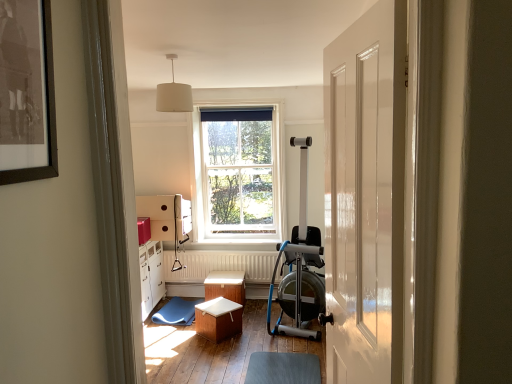
Identify the location of gray rubber footrest at lower center. (283, 368).

This screenshot has height=384, width=512. Describe the element at coordinates (283, 368) in the screenshot. I see `gray rubber footrest at lower center` at that location.

Describe the element at coordinates (174, 94) in the screenshot. I see `white fabric lampshade at upper center` at that location.

What do you see at coordinates (215, 351) in the screenshot?
I see `wooden box at center` at bounding box center [215, 351].

What do you see at coordinates (218, 319) in the screenshot? The width and height of the screenshot is (512, 384). I see `wooden stool at center, the second stool when ordered from back to front` at bounding box center [218, 319].

What do you see at coordinates (220, 265) in the screenshot? I see `white textured radiator at center` at bounding box center [220, 265].

You are a GUI agent. You are given a task and a screenshot of the screen. Output one action in this format:
    pyautogui.click(x=<x>, y=<y>)
    Task: Click on the gray rubber footrest at lower center
    The width and height of the screenshot is (512, 384).
    Given the screenshot: What is the action you would take?
    pyautogui.click(x=283, y=368)

Who is shorter, silver metallic rowing machine at center or wooden stool at center, which is counted as the 1th stool, starting from the back?

wooden stool at center, which is counted as the 1th stool, starting from the back, is shorter.

Does silver metallic rowing machine at center come in front of wooden stool at center, which is counted as the 1th stool, starting from the back?

Yes, the depth of silver metallic rowing machine at center is less than that of wooden stool at center, which is counted as the 1th stool, starting from the back.

Is silver metallic rowing machine at center outside of wooden stool at center, which is the 2th stool in front-to-back order?

Yes, silver metallic rowing machine at center is outside of wooden stool at center, which is the 2th stool in front-to-back order.

The width and height of the screenshot is (512, 384). I want to click on the 1st stool to the left when counting from the silver metallic rowing machine at center, so click(x=226, y=286).

Visually, is wooden box at center positioned to the left or to the right of blue rubber mat at center?

Clearly, wooden box at center is on the right of blue rubber mat at center in the image.

Is wooden box at center wider or thinner than blue rubber mat at center?

In the image, wooden box at center appears to be wider than blue rubber mat at center.

Between wooden box at center and blue rubber mat at center, which one is positioned in front?

wooden box at center is more forward.

Who is taller, white textured radiator at center or wooden stool at center, the second stool when ordered from back to front?

Standing taller between the two is white textured radiator at center.

Between white textured radiator at center and wooden stool at center, the second stool when ordered from back to front, which one has larger width?

wooden stool at center, the second stool when ordered from back to front, is wider.

From the image's perspective, is white textured radiator at center located beneath wooden stool at center, the second stool when ordered from back to front?

No.

Could you measure the distance between white fabric lampshade at upper center and wooden stool at center, which is the 2th stool in front-to-back order?

They are 7.86 feet apart.

Between white fabric lampshade at upper center and wooden stool at center, which is counted as the 1th stool, starting from the back, which one appears on the left side from the viewer's perspective?

white fabric lampshade at upper center is more to the left.

Who is smaller, white fabric lampshade at upper center or wooden stool at center, which is the 2th stool in front-to-back order?

A: With smaller size is white fabric lampshade at upper center.

Is white fabric lampshade at upper center far away from wooden stool at center, which is counted as the 1th stool, starting from the back?

Yes.

In the scene shown: From a real-world perspective, is white fabric lampshade at upper center on top of wooden stool at center, the second stool when ordered from back to front?

Yes, from a real-world perspective, white fabric lampshade at upper center is on top of wooden stool at center, the second stool when ordered from back to front.

Which point is more forward, (x=164, y=99) or (x=229, y=333)?

Point (x=164, y=99)

Which of these two, white fabric lampshade at upper center or wooden stool at center, the second stool when ordered from back to front, stands taller?

white fabric lampshade at upper center.

Can you confirm if white fabric lampshade at upper center is smaller than wooden stool at center, which ranks as the first stool in front-to-back order?

Correct, white fabric lampshade at upper center occupies less space than wooden stool at center, which ranks as the first stool in front-to-back order.

Is white textured radiator at center to the right of gray rubber footrest at lower center from the viewer's perspective?

Answer: In fact, white textured radiator at center is to the left of gray rubber footrest at lower center.

Are white textured radiator at center and gray rubber footrest at lower center beside each other?

There is a gap between white textured radiator at center and gray rubber footrest at lower center.

Consider the image. Which of these two, white textured radiator at center or gray rubber footrest at lower center, stands taller?

Standing taller between the two is white textured radiator at center.

From a real-world perspective, between white textured radiator at center and gray rubber footrest at lower center, who is vertically higher?

white textured radiator at center is physically above.

Is wooden stool at center, which is counted as the 1th stool, starting from the back, far away from blue rubber mat at center?

wooden stool at center, which is counted as the 1th stool, starting from the back, is near blue rubber mat at center, not far away.

Relative to blue rubber mat at center, is wooden stool at center, which is counted as the 1th stool, starting from the back, in front or behind?

wooden stool at center, which is counted as the 1th stool, starting from the back, is positioned farther from the viewer than blue rubber mat at center.

From a real-world perspective, is wooden stool at center, which is the 2th stool in front-to-back order, positioned under blue rubber mat at center based on gravity?

Actually, wooden stool at center, which is the 2th stool in front-to-back order, is physically above blue rubber mat at center in the real world.

At what (x,y) coordinates should I click in order to perform the action: click on the 1st stool directly beneath the silver metallic rowing machine at center (from a real-world perspective). Please return your answer as a coordinate pair (x, y). Image resolution: width=512 pixels, height=384 pixels. Looking at the image, I should click on (226, 286).

The width and height of the screenshot is (512, 384). In the image, there is a wooden box at center. Identify the location of swivel chair above it (from the image's perspective). (176, 312).

Looking at the image, which one is located closer to white fabric lampshade at upper center, white textured radiator at center or white wooden window at center?

The object closer to white fabric lampshade at upper center is white wooden window at center.

Considering their positions, is gray rubber footrest at lower center positioned closer to wooden stool at center, the second stool when ordered from back to front, than wooden stool at center, which is the 2th stool in front-to-back order?

wooden stool at center, which is the 2th stool in front-to-back order, is positioned closer to the anchor wooden stool at center, the second stool when ordered from back to front.

From the image, which object appears to be nearer to wooden stool at center, which ranks as the first stool in front-to-back order, blue rubber mat at center or wooden stool at center, which is the 2th stool in front-to-back order?

wooden stool at center, which is the 2th stool in front-to-back order, lies closer to wooden stool at center, which ranks as the first stool in front-to-back order, than the other object.

Considering their positions, is wooden stool at center, which is the 2th stool in front-to-back order, positioned closer to white textured radiator at center than blue rubber mat at center?

wooden stool at center, which is the 2th stool in front-to-back order, is positioned closer to the anchor white textured radiator at center.

Looking at the image, which one is located closer to gray rubber footrest at lower center, white fabric lampshade at upper center or blue rubber mat at center?

Based on the image, blue rubber mat at center appears to be nearer to gray rubber footrest at lower center.

Estimate the real-world distances between objects in this image. Which object is further from white textured radiator at center, white wooden window at center or wooden box at center?

wooden box at center.

Looking at the image, which one is located closer to wooden box at center, wooden stool at center, which is the 2th stool in front-to-back order, or wooden stool at center, which ranks as the first stool in front-to-back order?

wooden stool at center, which ranks as the first stool in front-to-back order, lies closer to wooden box at center than the other object.

Which object lies nearer to the anchor point wooden box at center, blue rubber mat at center or white wooden window at center?

blue rubber mat at center is closer to wooden box at center.

The height and width of the screenshot is (384, 512). I want to click on stool between gray rubber footrest at lower center and wooden stool at center, which is counted as the 1th stool, starting from the back, from front to back, so click(x=218, y=319).

Find the location of a particular element. Image resolution: width=512 pixels, height=384 pixels. corridor between white fabric lampshade at upper center and white wooden window at center in the front-back direction is located at coordinates (215, 351).

Find the location of a particular element. footrest between wooden box at center and white wooden window at center in the front-back direction is located at coordinates (283, 368).

I want to click on baby carriage that lies between white wooden window at center and wooden stool at center, which is counted as the 1th stool, starting from the back, from top to bottom, so click(300, 266).